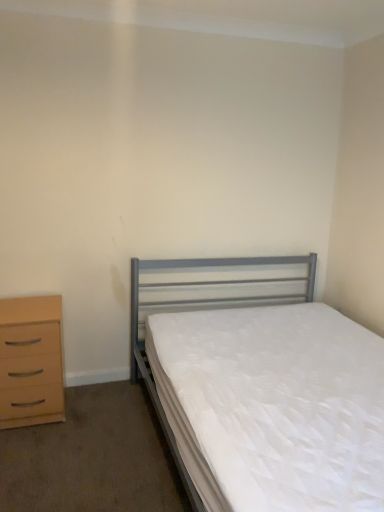
What are the coordinates of `free space to the right of light wood/texture chest of drawers at left` in the screenshot? It's located at (94, 410).